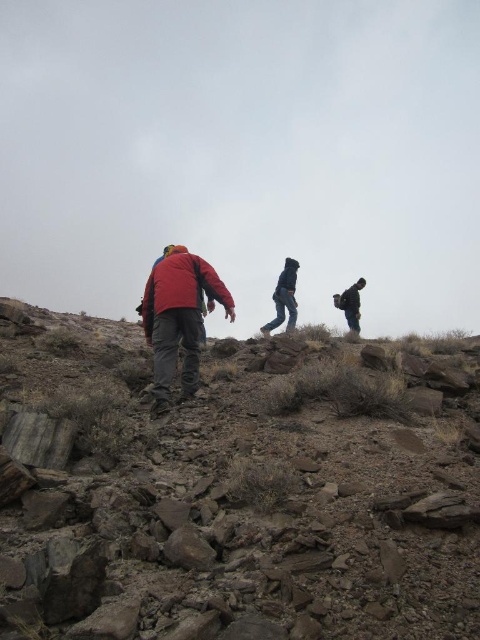
Question: Which point is closer to the camera taking this photo?

Choices:
 (A) (345, 310)
 (B) (322, 525)

Answer: (B)

Question: Does red matte jacket at center have a larger size compared to dark gray fabric backpack at right?

Choices:
 (A) yes
 (B) no

Answer: (A)

Question: Which point appears farthest from the camera in this image?

Choices:
 (A) (358, 330)
 (B) (196, 349)
 (C) (249, 374)

Answer: (A)

Question: Does red matte jacket at center lie in front of dark gray fabric backpack at right?

Choices:
 (A) yes
 (B) no

Answer: (A)

Question: Based on their relative distances, which object is farther from the rusty stone hillside at lower left?

Choices:
 (A) dark gray fabric backpack at right
 (B) red matte jacket at center

Answer: (A)

Question: Considering the relative positions of rusty stone hillside at lower left and dark gray fabric backpack at right in the image provided, where is rusty stone hillside at lower left located with respect to dark gray fabric backpack at right?

Choices:
 (A) left
 (B) right

Answer: (A)